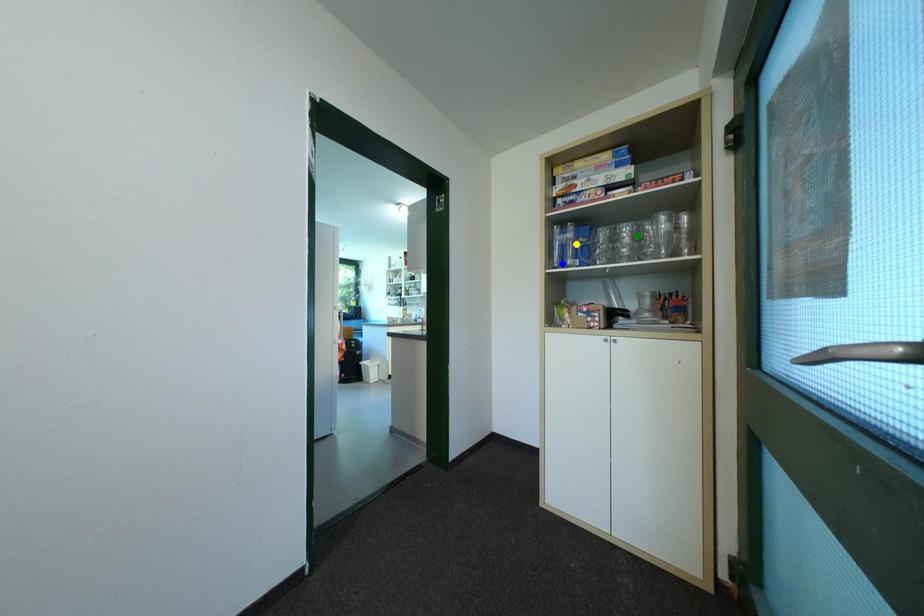
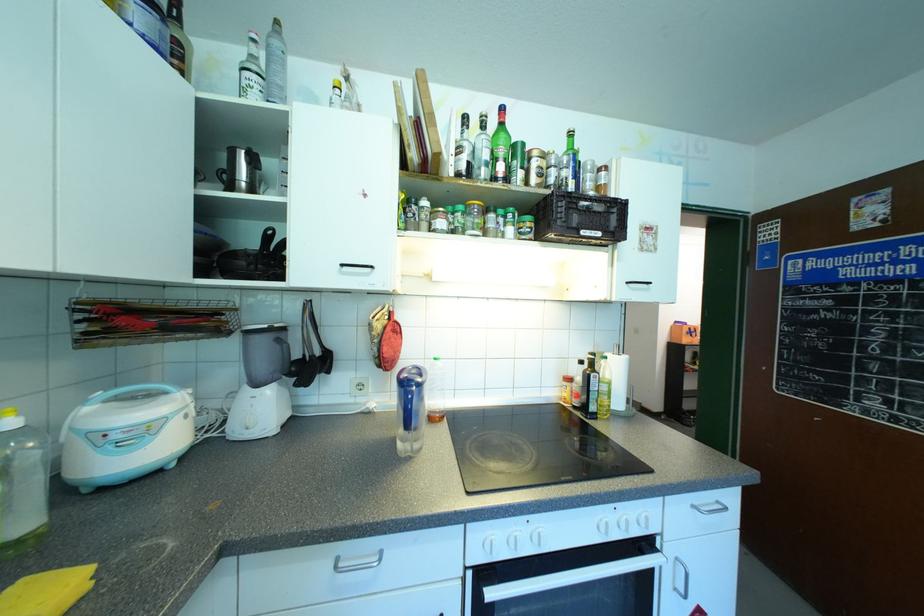
I am providing you with two images of the same scene from different viewpoints. Three points are marked in image1. Which point corresponds to a part or object that is occluded in image2?In image1, three points are marked. Which of them correspond to a part or object that is occluded in image2?Among the three points shown in image1, which one corresponds to a part or object that is no longer visible due to occlusion in image2?

blue point, yellow point, green point